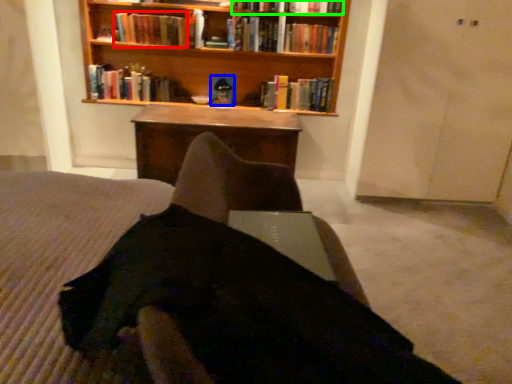
Question: Which object is positioned closest to book (highlighted by a red box)? Select from book (highlighted by a blue box) and book (highlighted by a green box).

Choices:
 (A) book
 (B) book

Answer: (A)